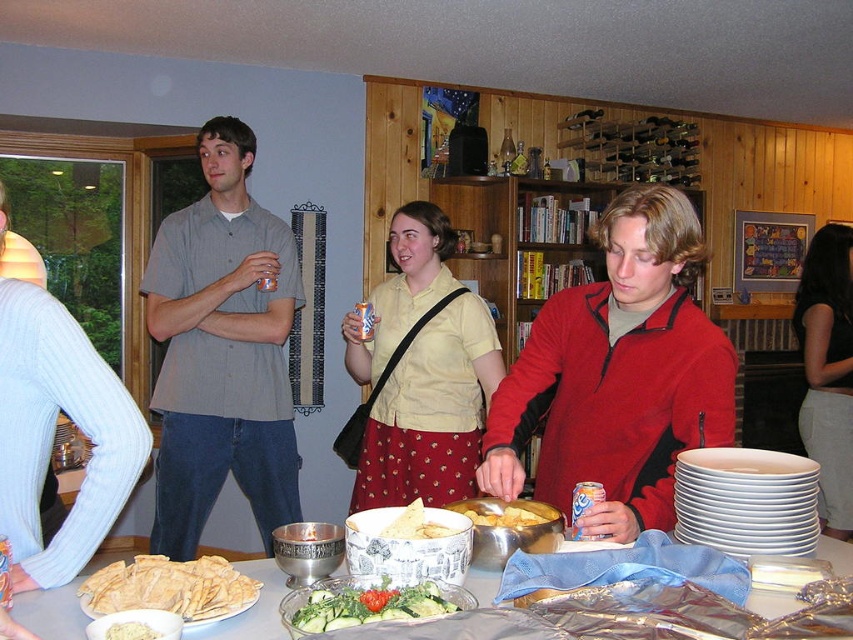
You are at a party and want to find the matte red jacket at center and the gray cotton shirt at left. If you are standing in front of the table, which direction should you look to see both items?

The matte red jacket at center is to the right of the gray cotton shirt at left. So, if you are standing in front of the table, you should look to your right to see the matte red jacket at center and to your left to see the gray cotton shirt at left.

You are a guest at the party and want to grab a plate from the table. The gray cotton shirt at left is blocking your path to the white ceramic plates at lower right. Which direction should you move to reach the plates without stepping over the shirt?

You should move to the right of the gray cotton shirt at left to reach the white ceramic plates at lower right since the shirt is positioned to the left of the plates.